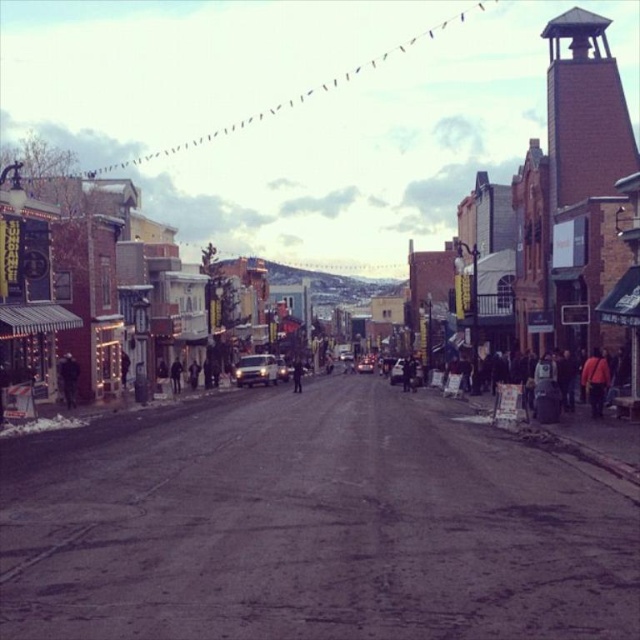
Does dark gray fabric crowd at center right have a greater height compared to metallic silver sedan at center?

Yes.

Is point (536, 388) farther from camera compared to point (364, 362)?

No.

Identify the location of dark gray fabric crowd at center right. Image resolution: width=640 pixels, height=640 pixels. (541, 385).

Describe the element at coordinates (296, 374) in the screenshot. I see `dark blue jeans at center` at that location.

Which is behind, point (292, 364) or point (362, 360)?

The point (362, 360) is behind.

Find the location of a particular element. This screenshot has width=640, height=640. dark blue jeans at center is located at coordinates (296, 374).

Is orange fabric jacket at right above dark blue jeans at center?

Yes, orange fabric jacket at right is above dark blue jeans at center.

Who is more distant from viewer, (604, 356) or (300, 365)?

The point (300, 365) is more distant.

What are the coordinates of `orange fabric jacket at right` in the screenshot? It's located at (595, 380).